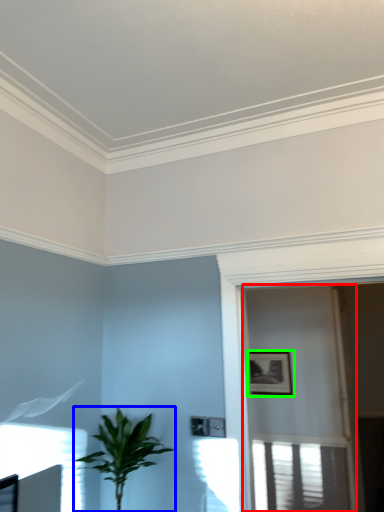
Question: Based on their relative distances, which object is nearer to screen door (highlighted by a red box)? Choose from houseplant (highlighted by a blue box) and picture frame (highlighted by a green box).

Choices:
 (A) houseplant
 (B) picture frame

Answer: (B)